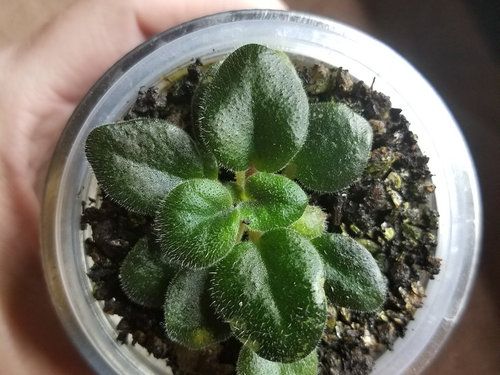
In order to click on glass container in this screenshot , I will do `click(463, 247)`.